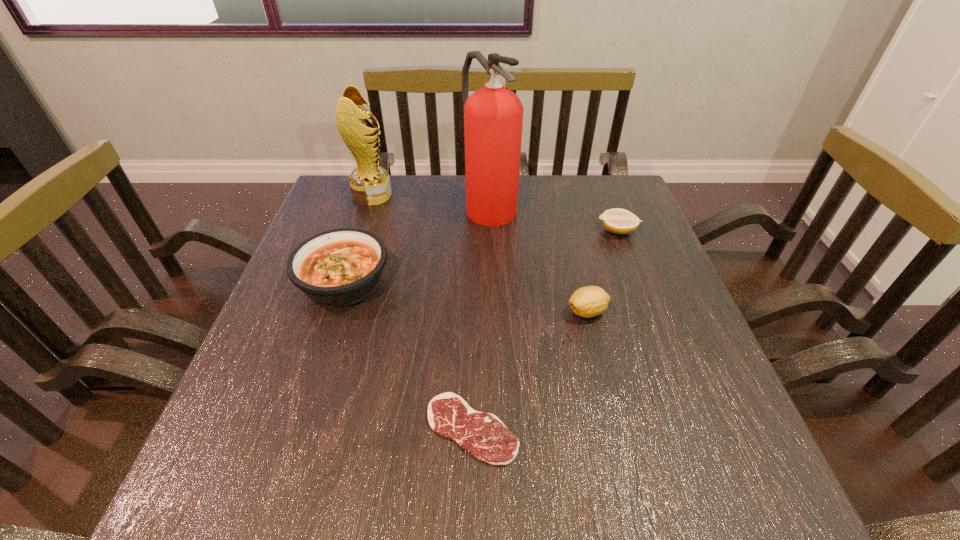
This screenshot has height=540, width=960. Identify the location of vacant region between the stew and the tallest object. [x=417, y=243].

The width and height of the screenshot is (960, 540). I want to click on vacant space in between the steak and the stew, so click(x=408, y=355).

This screenshot has width=960, height=540. Find the location of `empty space between the stew and the third shortest object`. empty space between the stew and the third shortest object is located at coordinates (466, 297).

Where is `blank region between the stew and the nearer lemon`? blank region between the stew and the nearer lemon is located at coordinates (466, 297).

The width and height of the screenshot is (960, 540). Find the location of `free space between the shorter lemon and the stew`. free space between the shorter lemon and the stew is located at coordinates (481, 256).

Locate an element on the screen. This screenshot has height=540, width=960. free spot between the rightmost object and the nearer lemon is located at coordinates (602, 272).

Where is `empty space between the fifth shortest object and the nearest object`? This screenshot has width=960, height=540. empty space between the fifth shortest object and the nearest object is located at coordinates (422, 312).

I want to click on vacant region between the taller lemon and the shortest object, so click(530, 370).

Select which object appears as the closest to the rightmost object. Please provide its 2D coordinates. Your answer should be formatted as a tuple, i.e. [(x, y)], where the tuple contains the x and y coordinates of a point satisfying the conditions above.

[(493, 116)]

Locate which object is the second closest to the steak. Please provide its 2D coordinates. Your answer should be formatted as a tuple, i.e. [(x, y)], where the tuple contains the x and y coordinates of a point satisfying the conditions above.

[(339, 267)]